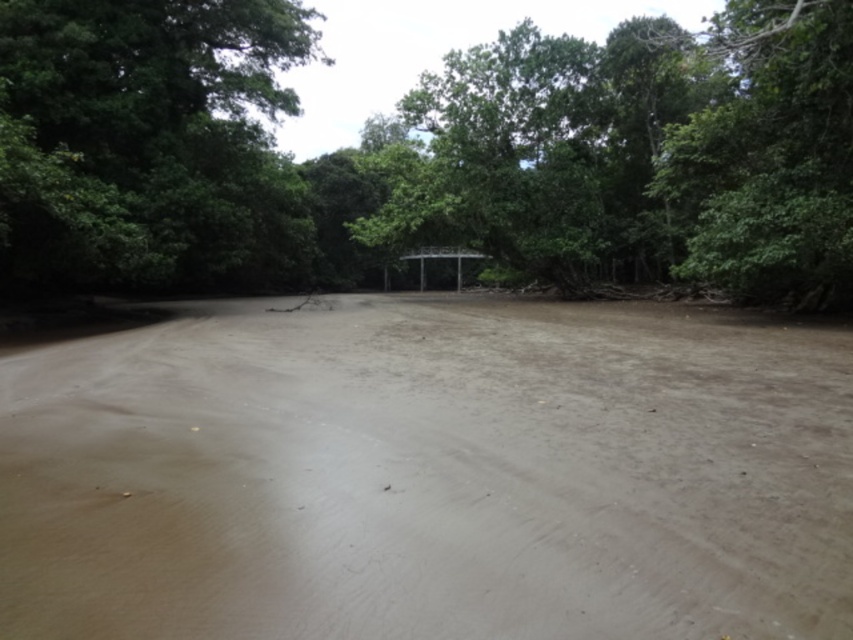
You are hiking through a forest and come across a muddy riverbed with a dirt track and a tree in the center. Which object is positioned to the left of the other? The objects are the brown muddy dirt track at center and the green leafy tree at center.

The brown muddy dirt track at center is positioned to the left of the green leafy tree at center.

You are standing at the edge of the muddy riverbed and want to walk towards the green leafy tree at center. Which direction should you head relative to the green leafy tree at upper left?

To reach the green leafy tree at center, you should head to the right of the green leafy tree at upper left since the green leafy tree at center is positioned to the right of it.

You are navigating a small boat along the muddy riverbed in the image. You spot two points marked on your map at coordinates point (502, 44) and point (126, 164). Which point should you approach first if you want to reach the point that is closer to your current position?

Point (126, 164) is closer to your current position because it is in front of point (502, 44), so you should approach point (126, 164) first.